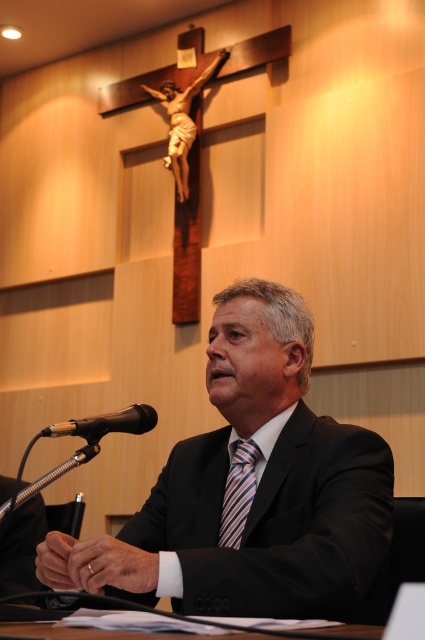
Can you confirm if black suit at center is positioned below black matte microphone at lower left?

Yes.

Who is positioned more to the left, black suit at center or black matte microphone at lower left?

black matte microphone at lower left is more to the left.

Is point (189, 589) in front of point (47, 429)?

Yes, it is.

Find the location of `black suit at center`. black suit at center is located at coordinates pos(255,490).

Which is below, black suit at center or striped silk tie at center?

striped silk tie at center

Is the position of black suit at center less distant than that of striped silk tie at center?

Yes.

Between point (176, 488) and point (252, 476), which one is positioned in front?

Point (252, 476) is more forward.

The height and width of the screenshot is (640, 425). I want to click on black suit at center, so click(x=255, y=490).

Does striped silk tie at center have a greater width compared to black matte microphone at lower left?

No, striped silk tie at center is not wider than black matte microphone at lower left.

Can you confirm if striped silk tie at center is positioned to the right of black matte microphone at lower left?

Yes, striped silk tie at center is to the right of black matte microphone at lower left.

Between point (235, 522) and point (47, 435), which one is positioned behind?

The point (235, 522) is behind.

Locate an element on the screen. The height and width of the screenshot is (640, 425). striped silk tie at center is located at coordinates (238, 492).